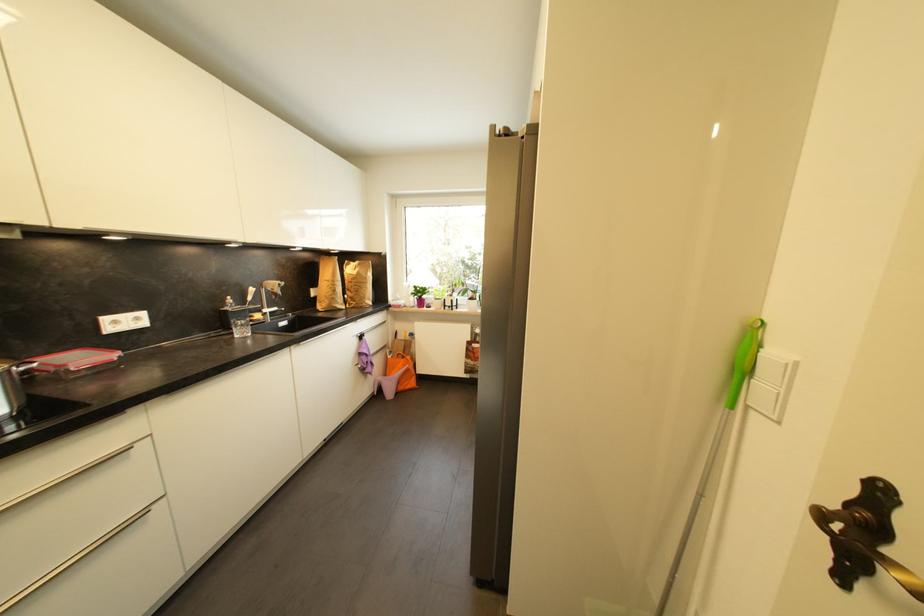
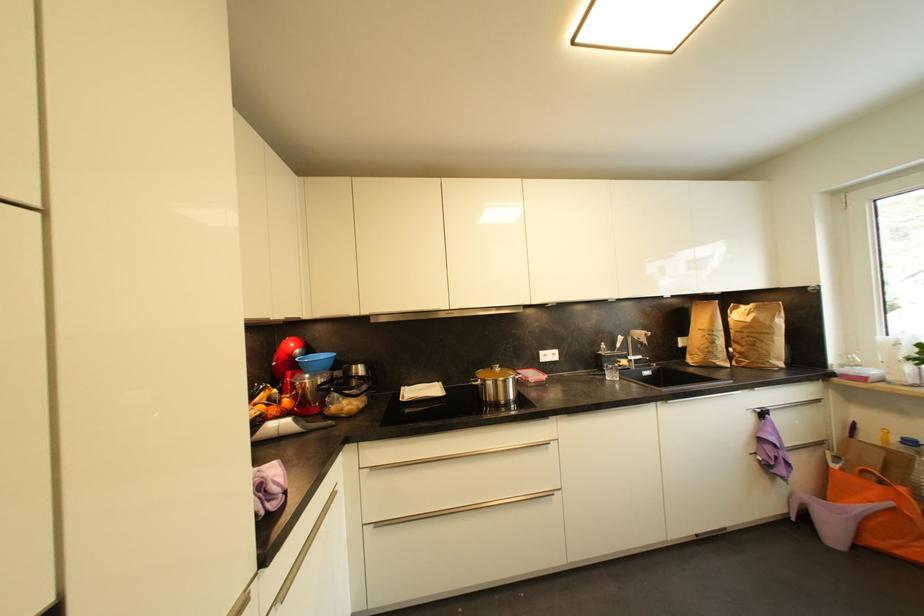
In the second image, find the point that corresponds to point 54,355 in the first image.

(528, 371)